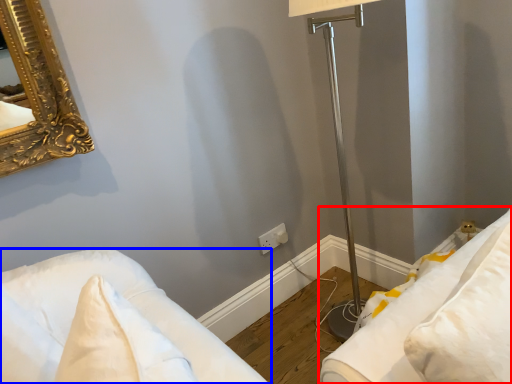
Question: Which object is further to the camera taking this photo, furniture (highlighted by a red box) or furniture (highlighted by a blue box)?

Choices:
 (A) furniture
 (B) furniture

Answer: (A)